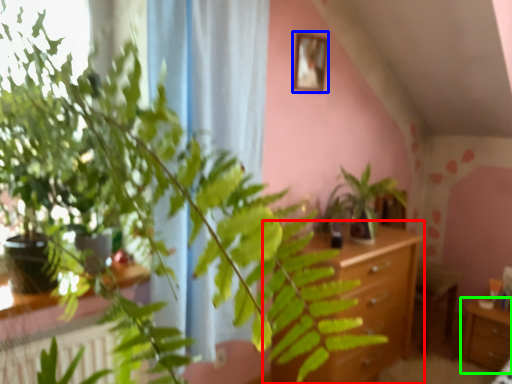
Question: Considering the real-world distances, which object is farthest from vanity (highlighted by a red box)? picture frame (highlighted by a blue box) or table (highlighted by a green box)?

Choices:
 (A) picture frame
 (B) table

Answer: (A)